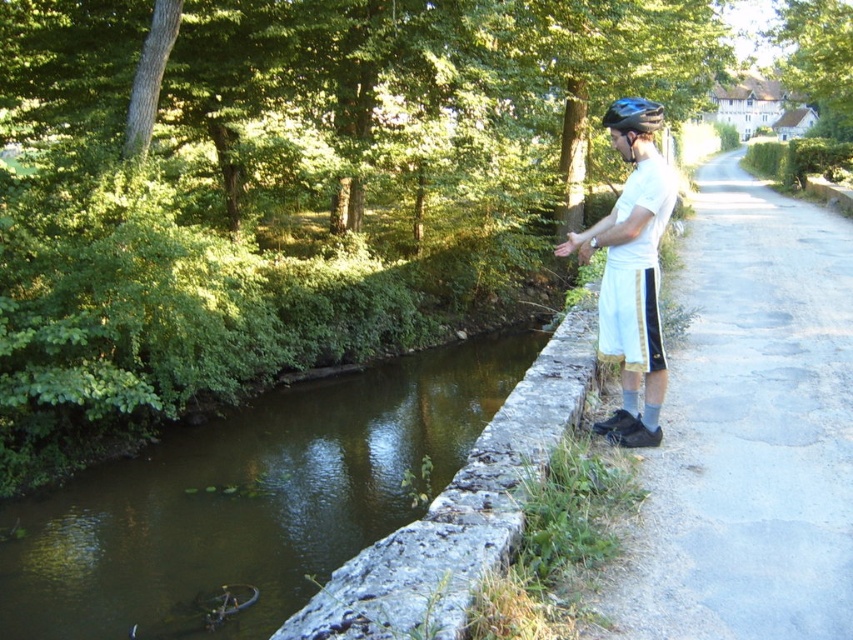
Question: Is gray concrete path at right wider than green mossy stone at center-left?

Choices:
 (A) no
 (B) yes

Answer: (B)

Question: Is stone ledge at center thinner than white cotton shorts at right?

Choices:
 (A) yes
 (B) no

Answer: (A)

Question: Is stone ledge at center above white cotton shorts at right?

Choices:
 (A) no
 (B) yes

Answer: (A)

Question: Which point is farther to the camera?

Choices:
 (A) (595, 284)
 (B) (643, 234)

Answer: (A)

Question: Which object is farther from the camera taking this photo?

Choices:
 (A) white cotton shorts at right
 (B) gray concrete path at right
 (C) blue matte bicycle helmet at upper center
 (D) green mossy stone at center-left

Answer: (D)

Question: Which object is farther from the camera taking this photo?

Choices:
 (A) blue matte bicycle helmet at upper center
 (B) green mossy stone at center-left

Answer: (B)